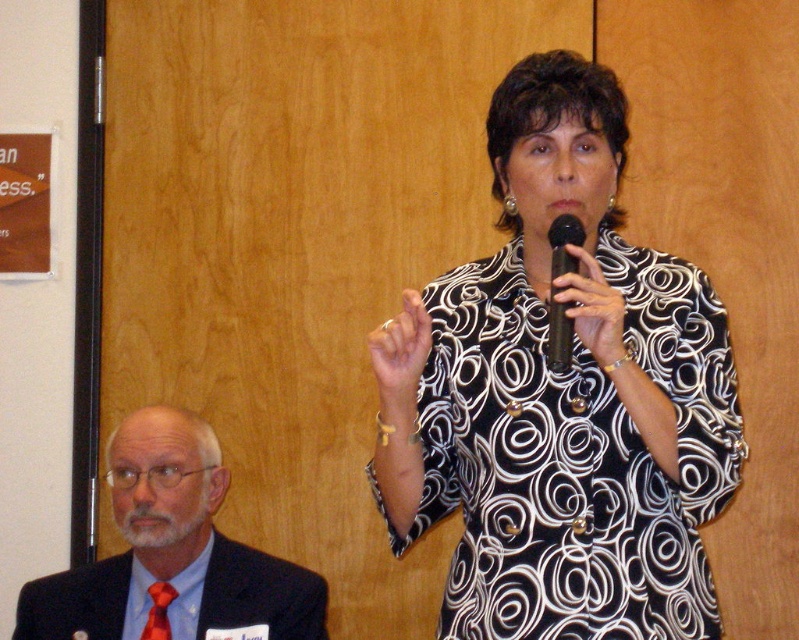
You are an event planner organizing a photoshoot in the conference room. You need to ensure that the black printed dress at center and the shiny red tie at lower left are visible in the frame. Based on their positions, which of these items will be easier to capture in a photo from the current angle?

The black printed dress at center is much taller than the shiny red tie at lower left, so it will be easier to capture in the photo from the current angle because its height makes it more prominent in the frame.

You are standing at the point labeled as point [309,602] in the image. If you want to move to the location where the woman is standing, which direction should you face to walk directly towards her?

You should face towards the woman who is standing in the foreground holding a microphone to walk directly towards her from point [309,602].

From the picture: What is the location of the point with coordinates [173,552] in the image?

The point with coordinates [173,552] is located on the matte black suit at lower left.